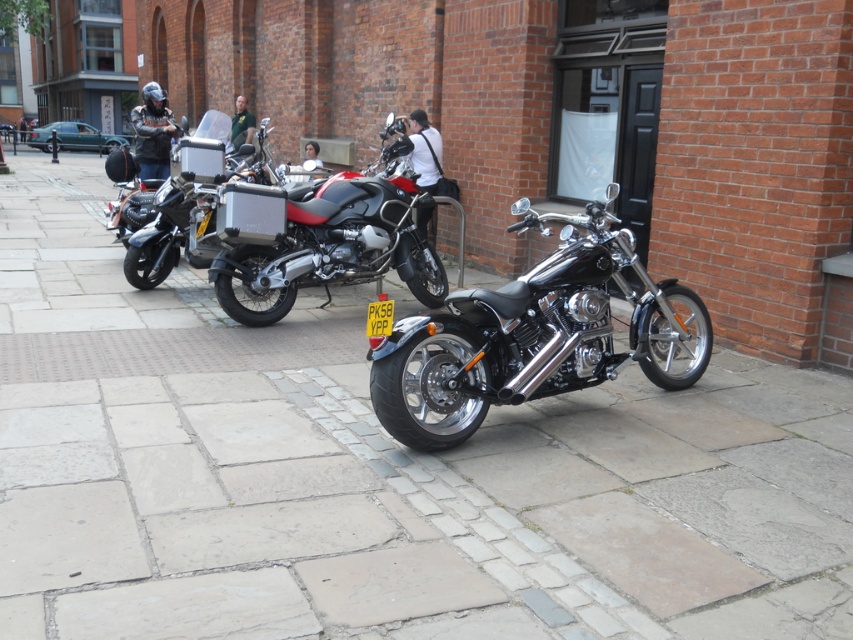
You are standing on the sidewalk looking at the row of motorcycles. Which motorcycle is closer to you, the shiny chrome motorcycle at center or the metallic silver motorcycle at center?

The shiny chrome motorcycle at center is closer to you because it is positioned under the metallic silver motorcycle at center, meaning it is in front of it.

You are standing on the sidewalk looking at the row of motorcycles. There is a metallic silver motorcycle at center and a matte black motorcycle at center. Which motorcycle is positioned to the right when viewed from the front?

The metallic silver motorcycle at center is positioned to the right of the matte black motorcycle at center when viewed from the front.

You are a delivery person trying to load your packages onto the shiny chrome motorcycle at center and the metallic silver motorcycle at center. Since both motorcycles are parked along the sidewalk, which motorcycle should you approach first if you want to start from the left side of the row?

The metallic silver motorcycle at center should be approached first because it is on the left side of the shiny chrome motorcycle at center.